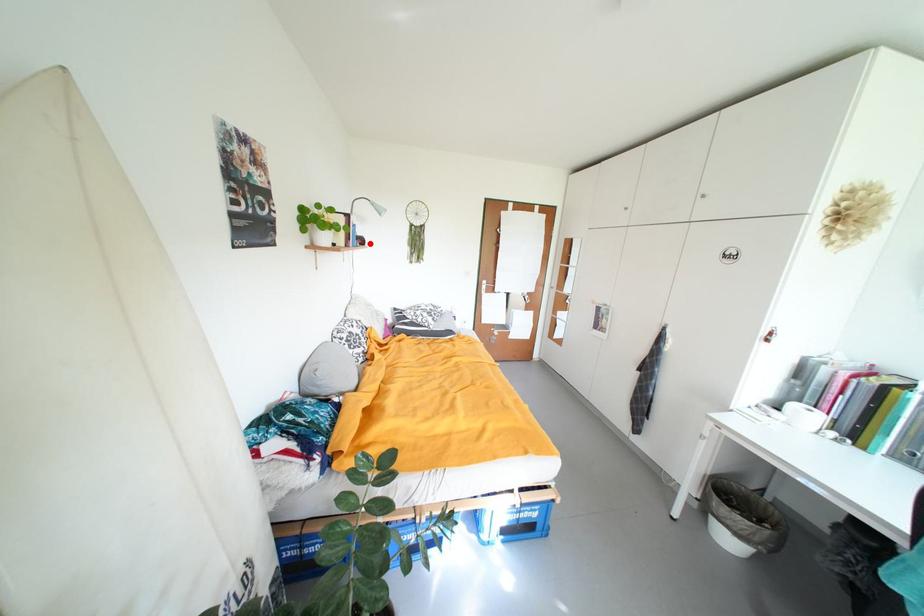
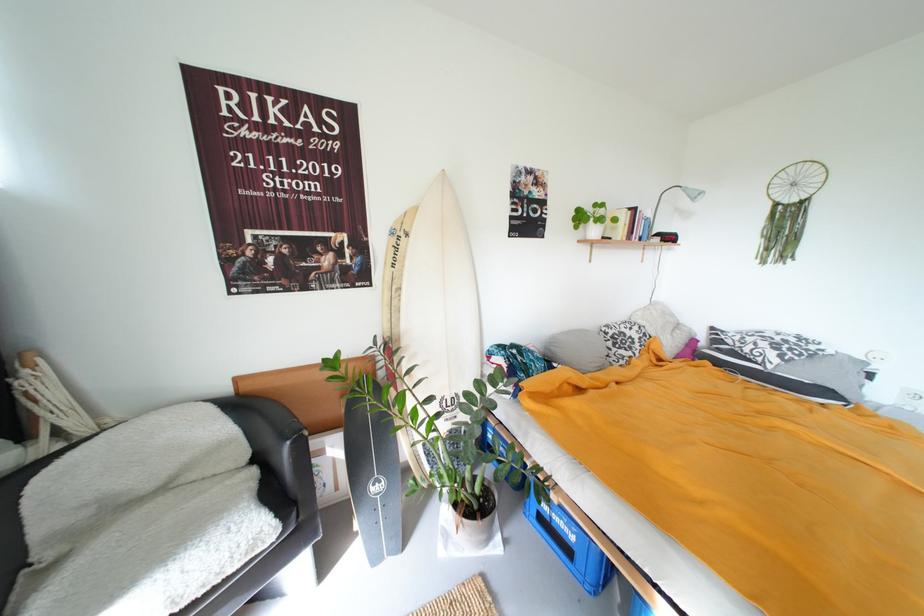
The point at the highlighted location is marked in the first image. Where is the corresponding point in the second image?

(677, 240)